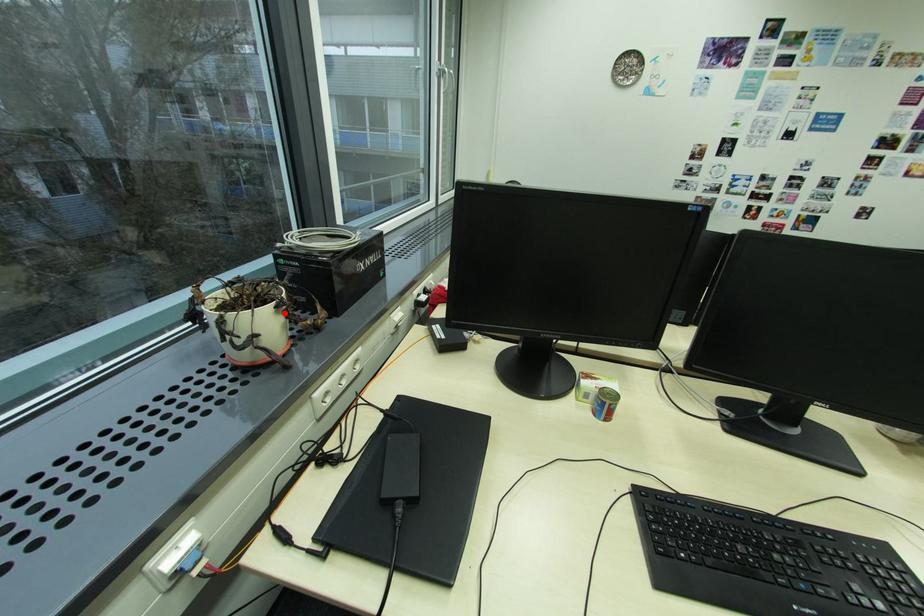
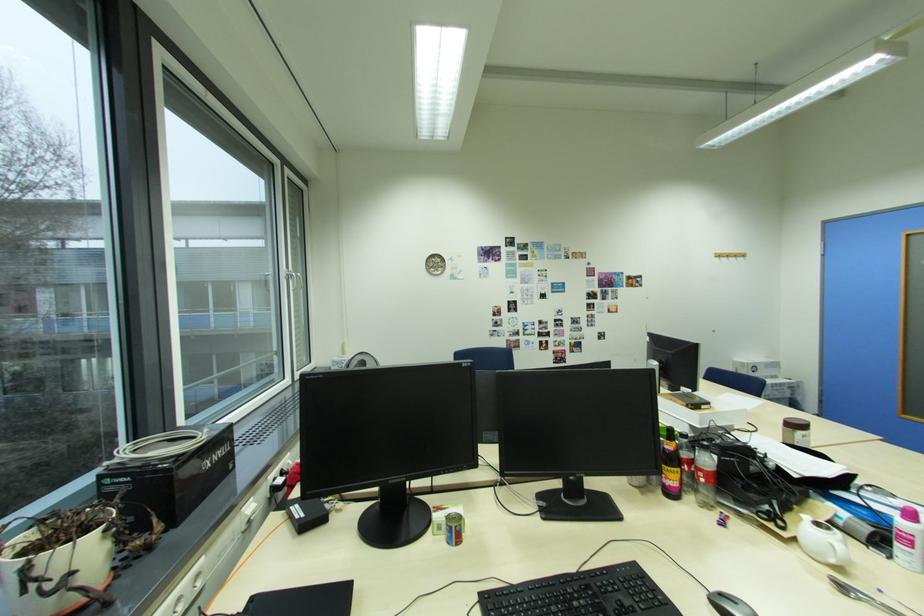
Locate, in the second image, the point that corresponds to the highlighted location in the first image.

(112, 539)